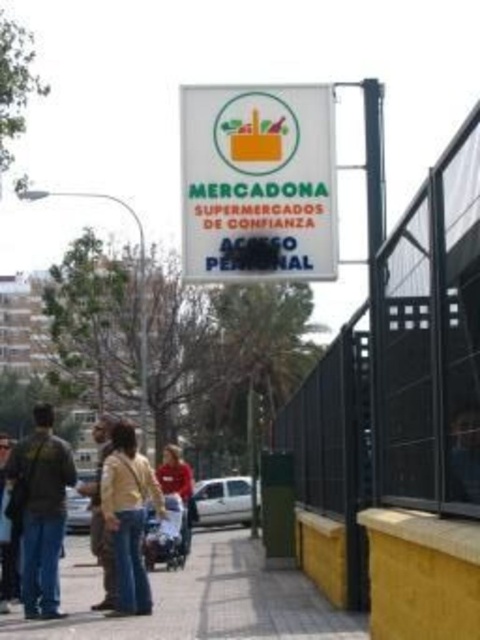
Between dark brown leather jacket at left and jeans at lower left, which one appears on the left side from the viewer's perspective?

jeans at lower left is more to the left.

Between dark brown leather jacket at left and jeans at lower left, which one has more height?

dark brown leather jacket at left is taller.

Does point (27, 488) come behind point (0, 435)?

No, (27, 488) is in front of (0, 435).

Find the location of a particular element. dark brown leather jacket at left is located at coordinates (40, 509).

Between black metal fence at upper right and red cotton shirt at center, which one is positioned lower?

Positioned lower is red cotton shirt at center.

How distant is black metal fence at upper right from red cotton shirt at center?

They are 12.36 meters apart.

The width and height of the screenshot is (480, 640). What do you see at coordinates (400, 420) in the screenshot?
I see `black metal fence at upper right` at bounding box center [400, 420].

Image resolution: width=480 pixels, height=640 pixels. Identify the location of black metal fence at upper right. (400, 420).

What do you see at coordinates (197, 600) in the screenshot? I see `yellow concrete pavement at lower center` at bounding box center [197, 600].

Can you confirm if yellow concrete pavement at lower center is positioned to the right of metallic bus stop at center?

Incorrect, yellow concrete pavement at lower center is not on the right side of metallic bus stop at center.

Does point (297, 579) come in front of point (285, 563)?

Yes, it is in front of point (285, 563).

At what (x,y) coordinates should I click in order to perform the action: click on yellow concrete pavement at lower center. Please return your answer as a coordinate pair (x, y). Looking at the image, I should click on (197, 600).